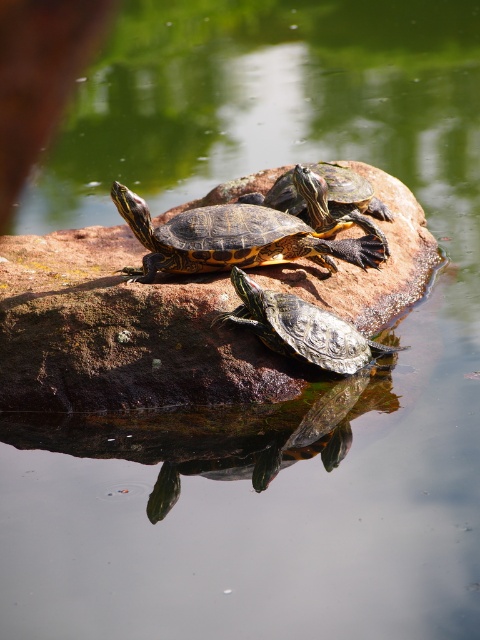
Is patterned shell turtle at center wider than shiny brown tortoise at center?

Correct, the width of patterned shell turtle at center exceeds that of shiny brown tortoise at center.

Does patterned shell turtle at center have a lesser width compared to shiny brown tortoise at center?

No.

Does point (217, 260) come behind point (298, 211)?

No, it is in front of (298, 211).

This screenshot has width=480, height=640. Identify the location of patterned shell turtle at center. (247, 234).

Between point (282, 321) and point (342, 170), which one is positioned behind?

The point (342, 170) is behind.

Who is higher up, shiny green tortoise at center or shiny brown tortoise at center?

shiny brown tortoise at center is above.

Is point (269, 348) positioned after point (367, 224)?

No.

What are the coordinates of `shiny green tortoise at center` in the screenshot? It's located at (300, 328).

Between patterned shell turtle at center and shiny green tortoise at center, which one is positioned lower?

Positioned lower is shiny green tortoise at center.

Can you confirm if patterned shell turtle at center is positioned to the left of shiny green tortoise at center?

Indeed, patterned shell turtle at center is positioned on the left side of shiny green tortoise at center.

Who is more forward, [334,221] or [257,310]?

Point [257,310] is in front.

You are a GUI agent. You are given a task and a screenshot of the screen. Output one action in this format:
    pyautogui.click(x=<x>, y=<y>)
    Task: Click on the patterned shell turtle at center
    The height and width of the screenshot is (640, 480).
    Given the screenshot: What is the action you would take?
    pyautogui.click(x=247, y=234)